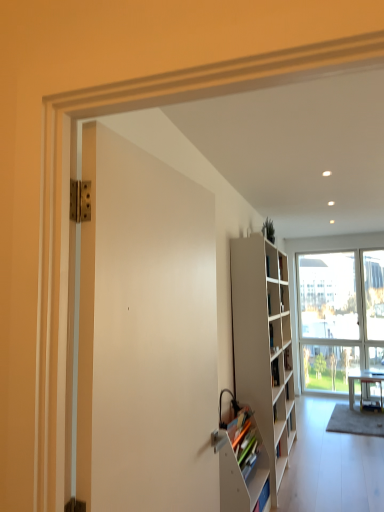
Question: Considering the positions of white glossy desk at lower right and green matte plant at upper center in the image, is white glossy desk at lower right bigger or smaller than green matte plant at upper center?

Choices:
 (A) big
 (B) small

Answer: (A)

Question: Would you say white glossy desk at lower right is inside or outside green matte plant at upper center?

Choices:
 (A) outside
 (B) inside

Answer: (A)

Question: Which of these objects is positioned farthest from the green matte plant at upper center?

Choices:
 (A) white glossy desk at lower right
 (B) white glass window at center
 (C) white matte bookshelf at right
 (D) white matte door at center
 (E) gray carpet at lower right

Answer: (D)

Question: Estimate the real-world distances between objects in this image. Which object is closer to the white matte door at center?

Choices:
 (A) gray carpet at lower right
 (B) white matte bookshelf at right
 (C) white glass window at center
 (D) white glossy desk at lower right
 (E) white matte bookshelf at lower right

Answer: (E)